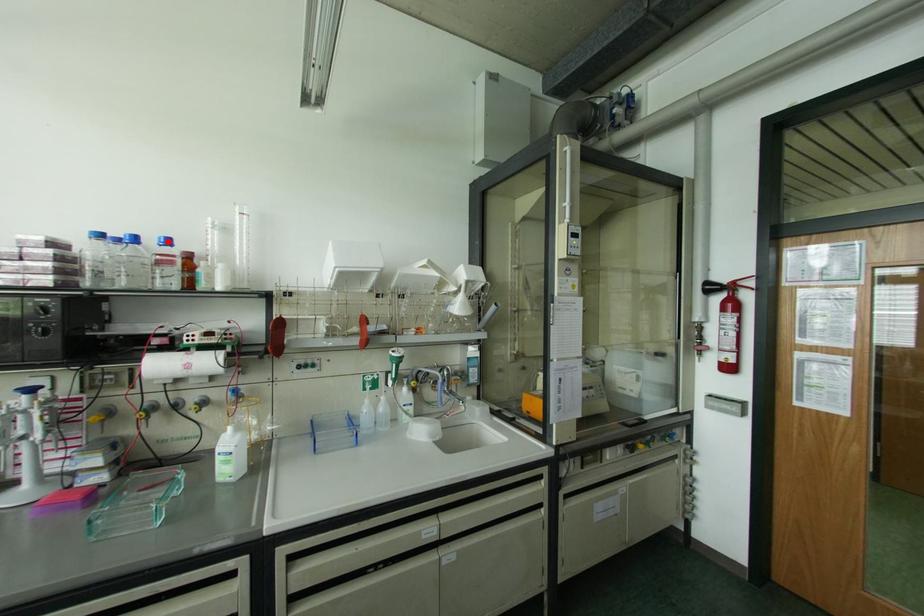
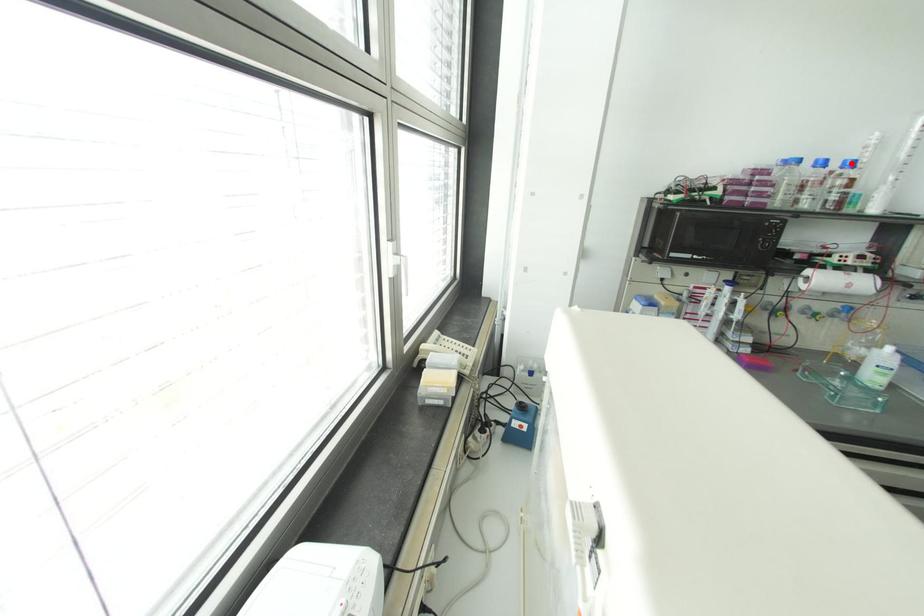
I am providing you with two images of the same scene from different viewpoints. A red point is marked on the first image and another point is marked on the second image. Do the highlighted points in image1 and image2 indicate the same real-world spot?

Yes